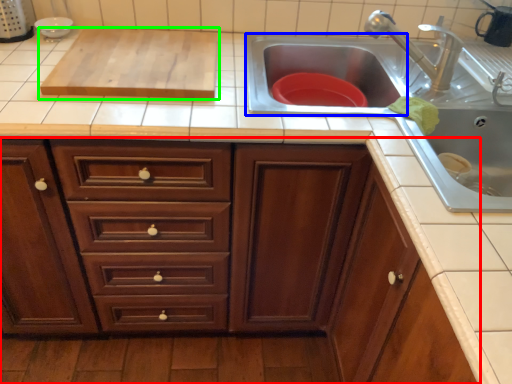
Question: Estimate the real-world distances between objects in this image. Which object is closer to cabinetry (highlighted by a red box), sink (highlighted by a blue box) or wide (highlighted by a green box)?

Choices:
 (A) sink
 (B) wide

Answer: (B)